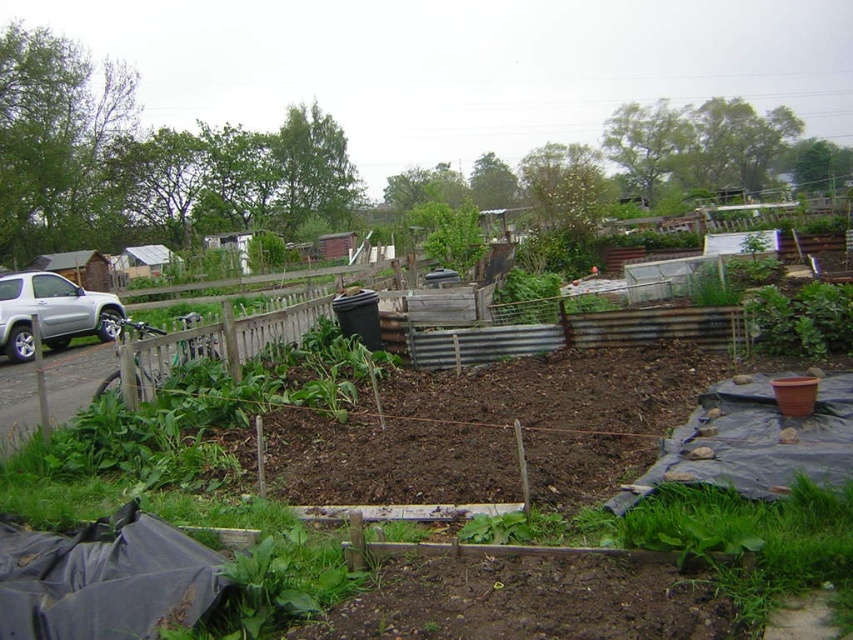
Which is below, silver metallic suv at left or green leafy plant at center-right?

green leafy plant at center-right

Find the location of a particular element. The width and height of the screenshot is (853, 640). silver metallic suv at left is located at coordinates (51, 312).